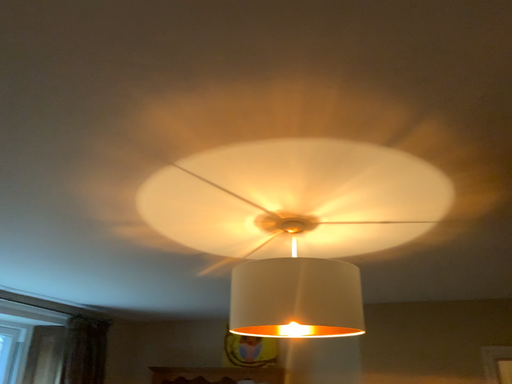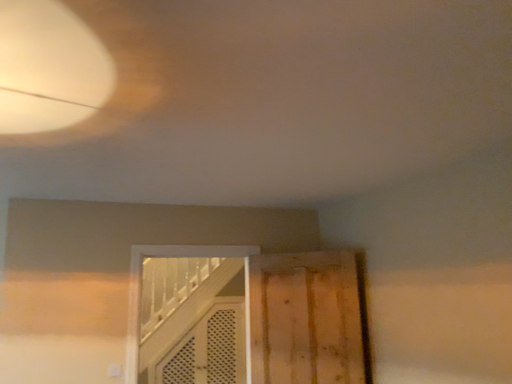
Question: Which way did the camera rotate in the video?

Choices:
 (A) rotated left
 (B) rotated right

Answer: (B)